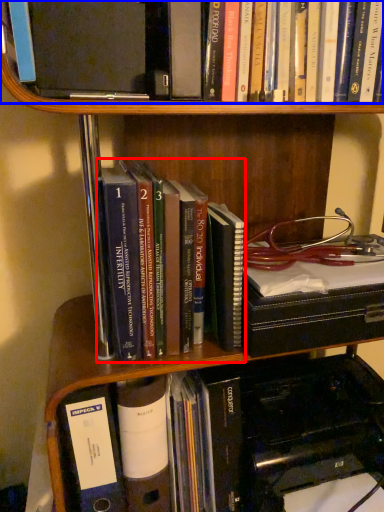
Question: Which object is closer to the camera taking this photo, book (highlighted by a red box) or book (highlighted by a blue box)?

Choices:
 (A) book
 (B) book

Answer: (B)